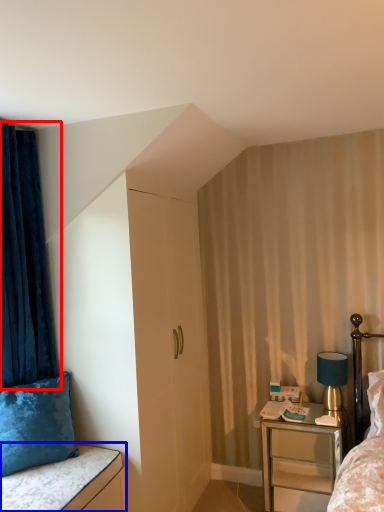
Question: Which object appears closest to the camera in this image, curtain (highlighted by a red box) or vanity (highlighted by a blue box)?

Choices:
 (A) curtain
 (B) vanity

Answer: (B)